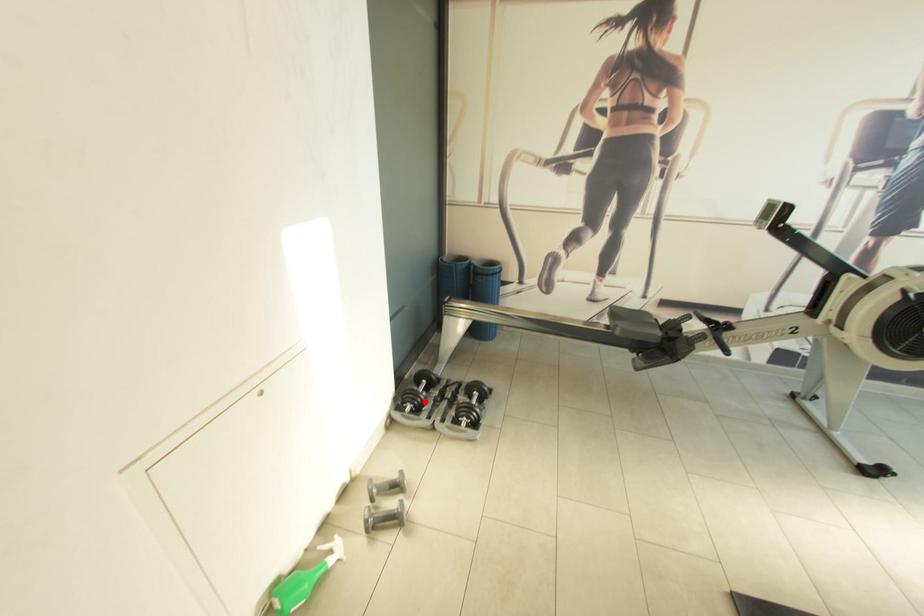
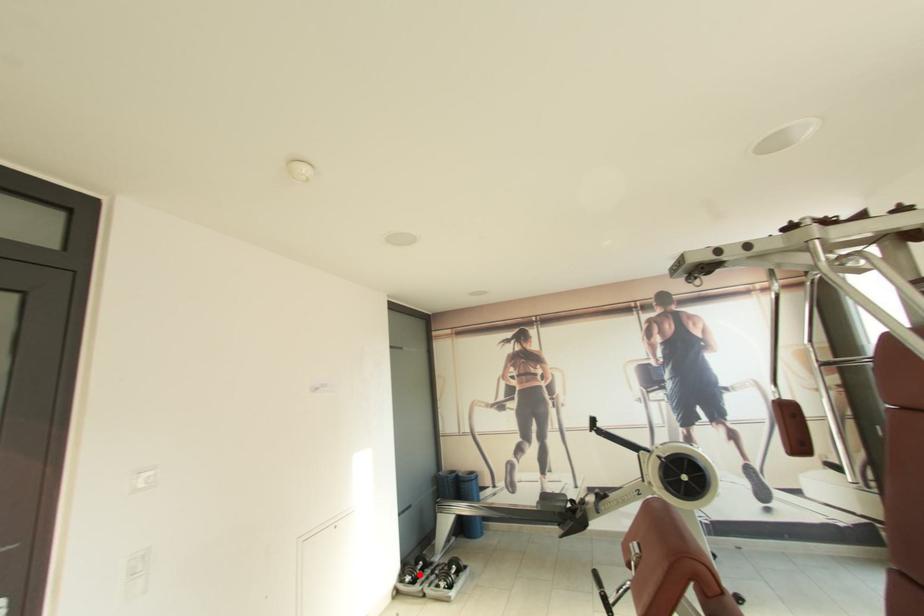
I am providing you with two images of the same scene from different viewpoints. A red point is marked on the first image and another point is marked on the second image. Is the red point in image1 aligned with the point shown in image2?

Yes